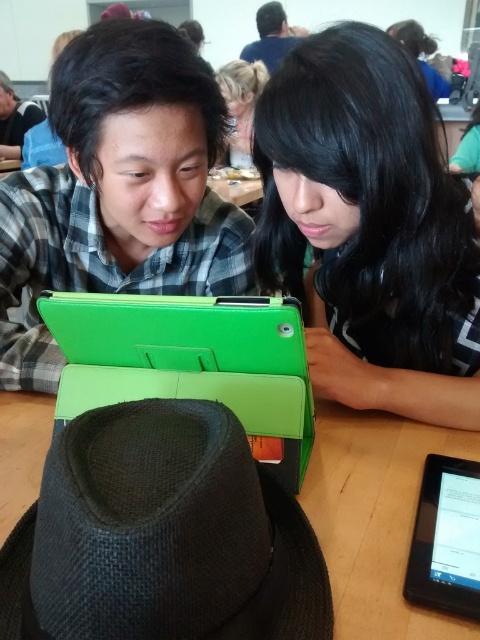
What are the coordinates of the green matte tablet at center?

The coordinates of the green matte tablet at center are at point [371,227].

You are a photographer trying to capture a closeup of the black matte tablet at lower right and the blonde hair at upper center in the scene. Which object should you focus on first to ensure it appears sharp in the photo?

You should focus on the black matte tablet at lower right first because it is closer to the viewer than the blonde hair at upper center, so focusing on it will ensure it is sharp while the background may blur slightly.

You are a delivery person who needs to place a small package between the green matte tablet at center and the matte black shirt at upper left. The package is 3 meters long. Will it fit between them?

The distance between the green matte tablet at center and the matte black shirt at upper left is 3.13 meters. Since the package is 3 meters long, it will fit between them as there is enough space.